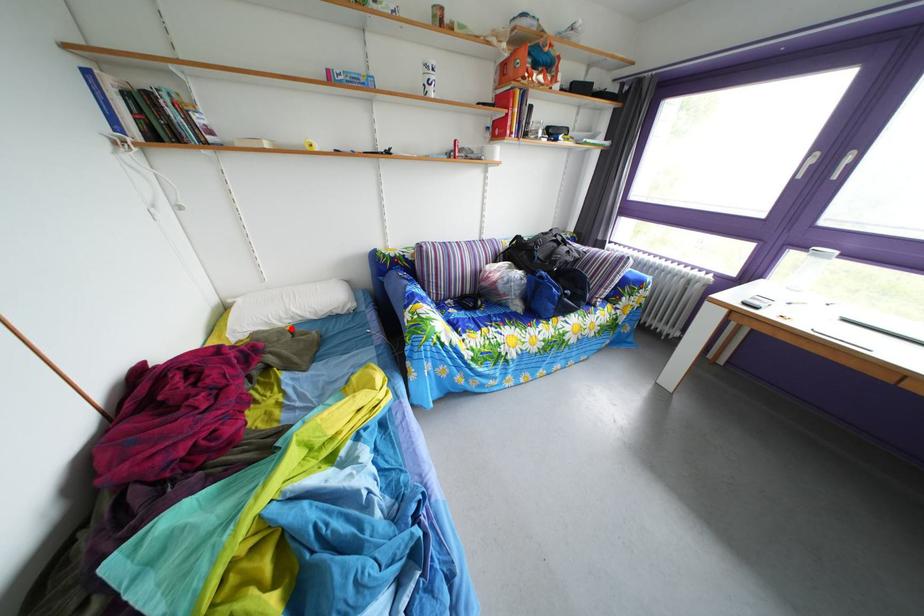
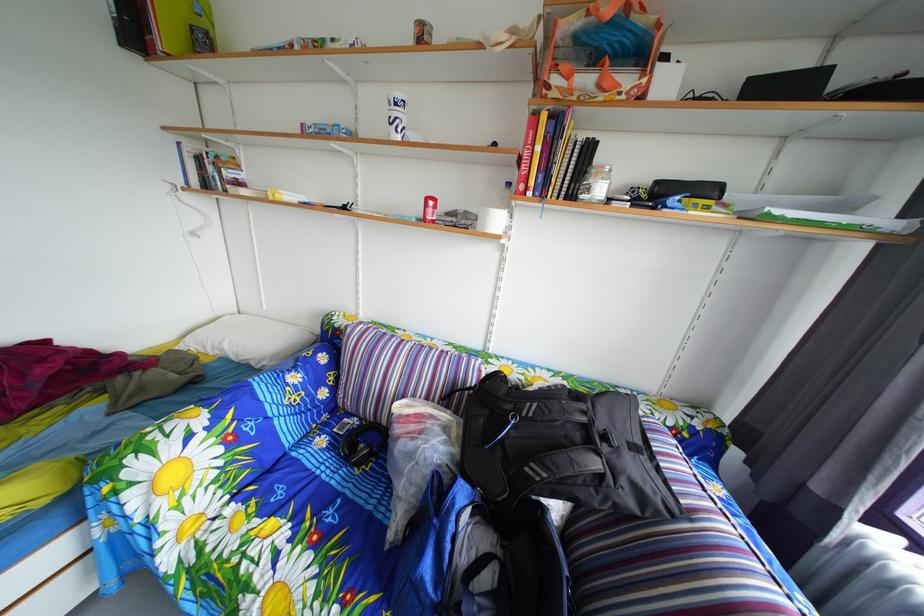
Question: I am providing you with two images of the same scene from different viewpoints. In image1, a red point is highlighted. Considering the same 3D point in image2, which of the following is correct?

Choices:
 (A) It is closer
 (B) It is farther

Answer: (B)